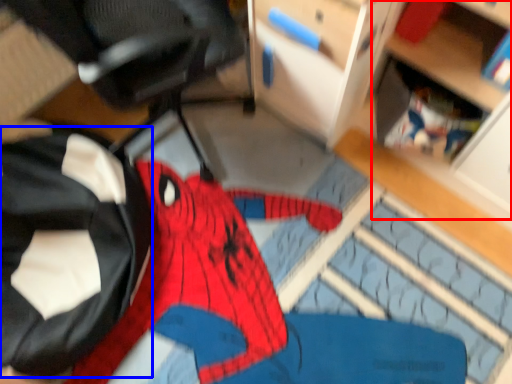
Question: Which object is further to the camera taking this photo, shelf (highlighted by a red box) or clothing (highlighted by a blue box)?

Choices:
 (A) shelf
 (B) clothing

Answer: (B)